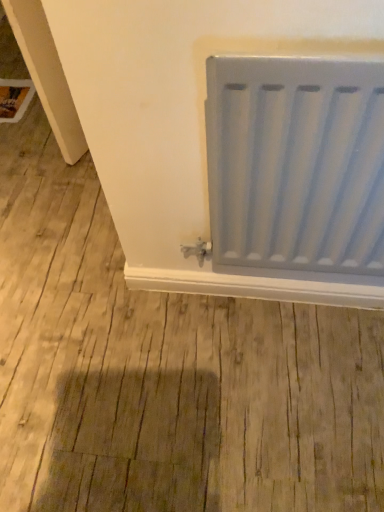
Question: Is satin white radiator at right situated inside white matte window sill at lower center or outside?

Choices:
 (A) inside
 (B) outside

Answer: (B)

Question: From the image's perspective, is satin white radiator at right positioned above or below white matte window sill at lower center?

Choices:
 (A) above
 (B) below

Answer: (A)

Question: From a real-world perspective, is satin white radiator at right physically located above or below white matte window sill at lower center?

Choices:
 (A) below
 (B) above

Answer: (B)

Question: Considering their positions, is white matte window sill at lower center located in front of or behind satin white radiator at right?

Choices:
 (A) behind
 (B) front

Answer: (A)

Question: From a real-world perspective, is white matte window sill at lower center physically located above or below satin white radiator at right?

Choices:
 (A) above
 (B) below

Answer: (B)

Question: Does point (292, 290) appear closer or farther from the camera than point (344, 248)?

Choices:
 (A) closer
 (B) farther

Answer: (B)

Question: Based on their sizes in the image, would you say white matte window sill at lower center is bigger or smaller than satin white radiator at right?

Choices:
 (A) big
 (B) small

Answer: (B)